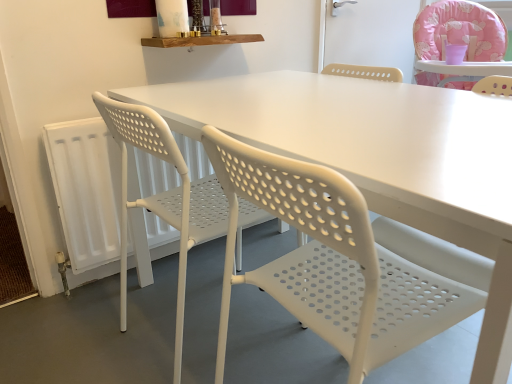
What do you see at coordinates (86, 189) in the screenshot? This screenshot has width=512, height=384. I see `white plastic radiator at lower left` at bounding box center [86, 189].

The height and width of the screenshot is (384, 512). Describe the element at coordinates (333, 262) in the screenshot. I see `white perforated plastic chair at center, positioned as the 2th chair in right-to-left order` at that location.

This screenshot has width=512, height=384. What are the coordinates of `pink fabric highchair at upper right, arranged as the 3th chair when viewed from the left` in the screenshot? It's located at (459, 30).

From a real-world perspective, is white perforated plastic chair at center, positioned as the 2th chair in right-to-left order, on pink fabric highchair at upper right, the first chair viewed from the right?

No, from a real-world perspective, white perforated plastic chair at center, positioned as the 2th chair in right-to-left order, is not over pink fabric highchair at upper right, the first chair viewed from the right

Can you confirm if white perforated plastic chair at center, which is the second chair from left to right, is bigger than pink fabric highchair at upper right, arranged as the 3th chair when viewed from the left?

Incorrect, white perforated plastic chair at center, which is the second chair from left to right, is not larger than pink fabric highchair at upper right, arranged as the 3th chair when viewed from the left.

Considering their positions, is white perforated plastic chair at center, which is the second chair from left to right, located in front of or behind pink fabric highchair at upper right, the first chair viewed from the right?

In the image, white perforated plastic chair at center, which is the second chair from left to right, appears in front of pink fabric highchair at upper right, the first chair viewed from the right.

Which of these two, white perforated plastic chair at center, positioned as the 2th chair in right-to-left order, or pink fabric highchair at upper right, the first chair viewed from the right, is wider?

Wider between the two is pink fabric highchair at upper right, the first chair viewed from the right.

How far apart are pink fabric highchair at upper right, the first chair viewed from the right, and white perforated plastic chair at center, which is the second chair from left to right?

They are 1.55 meters apart.

Is pink fabric highchair at upper right, the first chair viewed from the right, touching white perforated plastic chair at center, positioned as the 2th chair in right-to-left order?

No, pink fabric highchair at upper right, the first chair viewed from the right, is not touching white perforated plastic chair at center, positioned as the 2th chair in right-to-left order.

Between point (418, 73) and point (480, 298), which one is positioned in front?

The point (480, 298) is closer.

Is pink fabric highchair at upper right, arranged as the 3th chair when viewed from the left, located outside white perforated plastic chair at center, which is the second chair from left to right?

Yes, pink fabric highchair at upper right, arranged as the 3th chair when viewed from the left, is located beyond the bounds of white perforated plastic chair at center, which is the second chair from left to right.

Is white plastic radiator at lower left positioned far away from pink fabric highchair at upper right, the first chair viewed from the right?

Yes, white plastic radiator at lower left and pink fabric highchair at upper right, the first chair viewed from the right, are located far from each other.

Is point (116, 212) closer or farther from the camera than point (435, 80)?

Clearly, point (116, 212) is closer to the camera than point (435, 80).

Consider the image. In the image, is white plastic radiator at lower left positioned in front of or behind pink fabric highchair at upper right, the first chair viewed from the right?

Clearly, white plastic radiator at lower left is in front of pink fabric highchair at upper right, the first chair viewed from the right.

From a real-world perspective, is white plastic radiator at lower left positioned over pink fabric highchair at upper right, arranged as the 3th chair when viewed from the left, based on gravity?

Actually, white plastic radiator at lower left is physically below pink fabric highchair at upper right, arranged as the 3th chair when viewed from the left, in the real world.

Measure the distance from pink fabric highchair at upper right, arranged as the 3th chair when viewed from the left, to white perforated plastic chair at left, the third chair positioned from the right.

A distance of 4.72 feet exists between pink fabric highchair at upper right, arranged as the 3th chair when viewed from the left, and white perforated plastic chair at left, the third chair positioned from the right.

Is pink fabric highchair at upper right, arranged as the 3th chair when viewed from the left, directly adjacent to white perforated plastic chair at left, marked as the first chair in a left-to-right arrangement?

They are not placed beside each other.

From the image's perspective, is pink fabric highchair at upper right, the first chair viewed from the right, positioned above or below white perforated plastic chair at left, the third chair positioned from the right?

Based on their image positions, pink fabric highchair at upper right, the first chair viewed from the right, is located above white perforated plastic chair at left, the third chair positioned from the right.

Could you tell me if pink fabric highchair at upper right, arranged as the 3th chair when viewed from the left, is turned towards white perforated plastic chair at left, marked as the first chair in a left-to-right arrangement?

No, pink fabric highchair at upper right, arranged as the 3th chair when viewed from the left, is not aimed at white perforated plastic chair at left, marked as the first chair in a left-to-right arrangement.

From a real-world perspective, count 1st chairs upward from the white plastic radiator at lower left and point to it. Please provide its 2D coordinates.

[(164, 197)]

From a real-world perspective, is white plastic radiator at lower left below white perforated plastic chair at left, the third chair positioned from the right?

Yes.

Is white plastic radiator at lower left smaller than white perforated plastic chair at left, marked as the first chair in a left-to-right arrangement?

Yes, white plastic radiator at lower left is smaller than white perforated plastic chair at left, marked as the first chair in a left-to-right arrangement.

Which point is more forward, (83,258) or (158,151)?

Positioned in front is point (158,151).

From a real-world perspective, is white perforated plastic chair at center, which is the second chair from left to right, below white plastic radiator at lower left?

No.

Is white perforated plastic chair at center, positioned as the 2th chair in right-to-left order, bigger or smaller than white plastic radiator at lower left?

white perforated plastic chair at center, positioned as the 2th chair in right-to-left order, is bigger than white plastic radiator at lower left.

From the picture: Would you say white perforated plastic chair at center, which is the second chair from left to right, is outside white plastic radiator at lower left?

That's correct, white perforated plastic chair at center, which is the second chair from left to right, is outside of white plastic radiator at lower left.

Which is in front, point (367, 329) or point (88, 176)?

The point (367, 329) is more forward.

From a real-world perspective, which is physically above, pink fabric highchair at upper right, the first chair viewed from the right, or white plastic radiator at lower left?

From a 3D spatial view, pink fabric highchair at upper right, the first chair viewed from the right, is above.

Which object is further away from the camera taking this photo, pink fabric highchair at upper right, arranged as the 3th chair when viewed from the left, or white plastic radiator at lower left?

pink fabric highchair at upper right, arranged as the 3th chair when viewed from the left, is further from the camera.

How different are the orientations of pink fabric highchair at upper right, the first chair viewed from the right, and white plastic radiator at lower left in degrees?

There is a 42.4-degree angle between the facing directions of pink fabric highchair at upper right, the first chair viewed from the right, and white plastic radiator at lower left.

Measure the distance from pink fabric highchair at upper right, the first chair viewed from the right, to white plastic radiator at lower left.

pink fabric highchair at upper right, the first chair viewed from the right, and white plastic radiator at lower left are 1.45 meters apart.

You are a GUI agent. You are given a task and a screenshot of the screen. Output one action in this format:
    pyautogui.click(x=<x>, y=<y>)
    Task: Click on the chair that is the 2nd one when counting downward from the pink fabric highchair at upper right, the first chair viewed from the right (from the image's perspective)
    The height and width of the screenshot is (384, 512).
    Given the screenshot: What is the action you would take?
    pyautogui.click(x=333, y=262)

This screenshot has height=384, width=512. Find the location of `chair that is the 1st one below the pink fabric highchair at upper right, the first chair viewed from the right (from a real-world perspective)`. chair that is the 1st one below the pink fabric highchair at upper right, the first chair viewed from the right (from a real-world perspective) is located at coordinates (333, 262).

Which object lies nearer to the anchor point pink fabric highchair at upper right, arranged as the 3th chair when viewed from the left, white plastic radiator at lower left or white perforated plastic chair at left, marked as the first chair in a left-to-right arrangement?

The object closer to pink fabric highchair at upper right, arranged as the 3th chair when viewed from the left, is white perforated plastic chair at left, marked as the first chair in a left-to-right arrangement.

From the picture: Based on their spatial positions, is white plastic radiator at lower left or pink fabric highchair at upper right, the first chair viewed from the right, further from white perforated plastic chair at center, which is the second chair from left to right?

Answer: pink fabric highchair at upper right, the first chair viewed from the right.

Estimate the real-world distances between objects in this image. Which object is further from white plastic radiator at lower left, pink fabric highchair at upper right, arranged as the 3th chair when viewed from the left, or white perforated plastic chair at center, which is the second chair from left to right?

The object further to white plastic radiator at lower left is pink fabric highchair at upper right, arranged as the 3th chair when viewed from the left.

Considering their positions, is white perforated plastic chair at center, positioned as the 2th chair in right-to-left order, positioned closer to white perforated plastic chair at left, marked as the first chair in a left-to-right arrangement, than pink fabric highchair at upper right, the first chair viewed from the right?

white perforated plastic chair at center, positioned as the 2th chair in right-to-left order, is closer to white perforated plastic chair at left, marked as the first chair in a left-to-right arrangement.

Which object lies nearer to the anchor point white perforated plastic chair at left, marked as the first chair in a left-to-right arrangement, white perforated plastic chair at center, which is the second chair from left to right, or white plastic radiator at lower left?

Among the two, white plastic radiator at lower left is located nearer to white perforated plastic chair at left, marked as the first chair in a left-to-right arrangement.

From the image, which object appears to be nearer to white perforated plastic chair at center, which is the second chair from left to right, pink fabric highchair at upper right, arranged as the 3th chair when viewed from the left, or white plastic radiator at lower left?

white plastic radiator at lower left lies closer to white perforated plastic chair at center, which is the second chair from left to right, than the other object.

From the image, which object appears to be nearer to white perforated plastic chair at center, positioned as the 2th chair in right-to-left order, white plastic radiator at lower left or white perforated plastic chair at left, the third chair positioned from the right?

Based on the image, white perforated plastic chair at left, the third chair positioned from the right, appears to be nearer to white perforated plastic chair at center, positioned as the 2th chair in right-to-left order.

Based on their spatial positions, is white perforated plastic chair at left, marked as the first chair in a left-to-right arrangement, or white perforated plastic chair at center, positioned as the 2th chair in right-to-left order, further from white plastic radiator at lower left?

Among the two, white perforated plastic chair at center, positioned as the 2th chair in right-to-left order, is located further to white plastic radiator at lower left.

Image resolution: width=512 pixels, height=384 pixels. I want to click on chair between white perforated plastic chair at center, positioned as the 2th chair in right-to-left order, and white plastic radiator at lower left in the front-back direction, so click(164, 197).

This screenshot has width=512, height=384. Find the location of `chair between white perforated plastic chair at left, marked as the first chair in a left-to-right arrangement, and pink fabric highchair at upper right, arranged as the 3th chair when viewed from the left, from left to right`. chair between white perforated plastic chair at left, marked as the first chair in a left-to-right arrangement, and pink fabric highchair at upper right, arranged as the 3th chair when viewed from the left, from left to right is located at coordinates (333, 262).